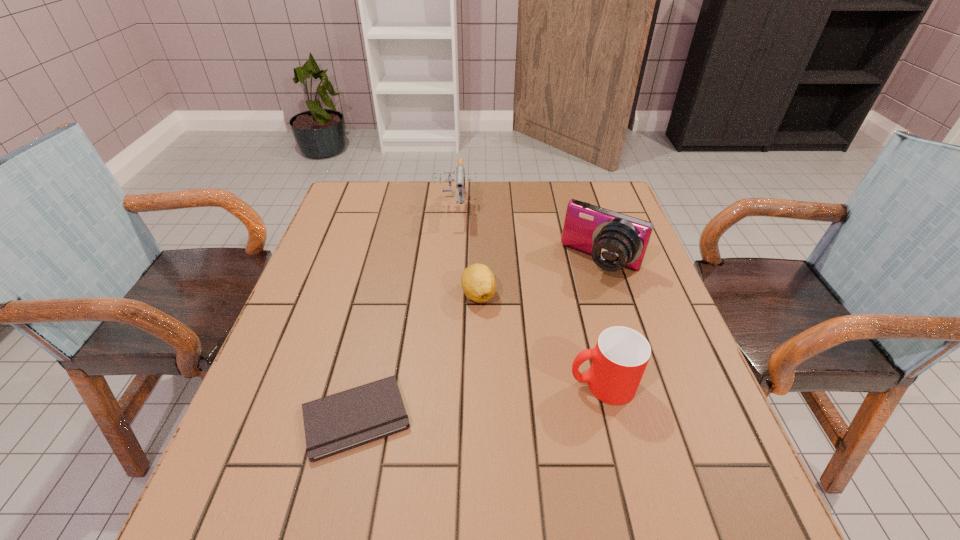
Locate an element on the screen. The width and height of the screenshot is (960, 540). free space on the desktop that is between the shortest object and the cup and is positioned at the stem end of the lemon is located at coordinates (458, 404).

Where is `vacant space on the desktop that is between the shortest object and the cup and is positioned at the barrel end of the farthest object`? The height and width of the screenshot is (540, 960). vacant space on the desktop that is between the shortest object and the cup and is positioned at the barrel end of the farthest object is located at coordinates (449, 405).

The width and height of the screenshot is (960, 540). I want to click on vacant space on the desktop that is between the shortest object and the cup and is positioned on the front-facing side of the camera, so pos(513,397).